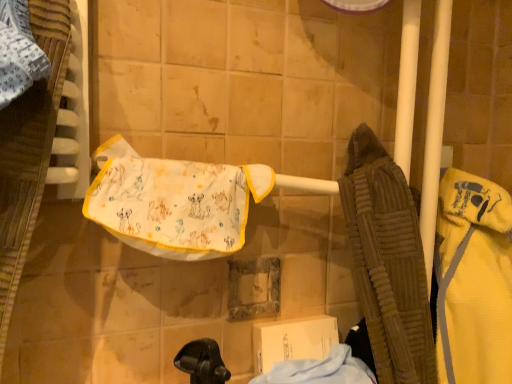
Question: Considering the relative sizes of yellow fleece bathrobe at right and white fabric towel at center in the image provided, is yellow fleece bathrobe at right taller than white fabric towel at center?

Choices:
 (A) no
 (B) yes

Answer: (B)

Question: Is yellow fleece bathrobe at right to the right of white fabric towel at center from the viewer's perspective?

Choices:
 (A) yes
 (B) no

Answer: (A)

Question: Is yellow fleece bathrobe at right not near white fabric towel at center?

Choices:
 (A) yes
 (B) no

Answer: (B)

Question: Can you see yellow fleece bathrobe at right touching white fabric towel at center?

Choices:
 (A) no
 (B) yes

Answer: (A)

Question: From a real-world perspective, is yellow fleece bathrobe at right on top of white fabric towel at center?

Choices:
 (A) no
 (B) yes

Answer: (A)

Question: From a real-world perspective, is yellow fleece bathrobe at right positioned above or below white fabric towel at center?

Choices:
 (A) below
 (B) above

Answer: (A)

Question: Is point (481, 377) closer or farther from the camera than point (248, 185)?

Choices:
 (A) farther
 (B) closer

Answer: (A)

Question: From the image's perspective, relative to white fabric towel at center, is yellow fleece bathrobe at right above or below?

Choices:
 (A) below
 (B) above

Answer: (A)

Question: Choose the correct answer: Is yellow fleece bathrobe at right inside white fabric towel at center or outside it?

Choices:
 (A) inside
 (B) outside

Answer: (B)

Question: Considering the relative positions of light blue cotton cloth at lower center and white fabric towel at center in the image provided, is light blue cotton cloth at lower center to the left or to the right of white fabric towel at center?

Choices:
 (A) right
 (B) left

Answer: (A)

Question: Is light blue cotton cloth at lower center in front of or behind white fabric towel at center in the image?

Choices:
 (A) front
 (B) behind

Answer: (A)

Question: From a real-world perspective, is light blue cotton cloth at lower center physically located above or below white fabric towel at center?

Choices:
 (A) above
 (B) below

Answer: (B)

Question: Considering the positions of light blue cotton cloth at lower center and white fabric towel at center in the image, is light blue cotton cloth at lower center bigger or smaller than white fabric towel at center?

Choices:
 (A) small
 (B) big

Answer: (A)

Question: From the image's perspective, is yellow fleece bathrobe at right positioned above or below light blue cotton cloth at lower center?

Choices:
 (A) below
 (B) above

Answer: (B)

Question: From a real-world perspective, is yellow fleece bathrobe at right positioned above or below light blue cotton cloth at lower center?

Choices:
 (A) below
 (B) above

Answer: (B)